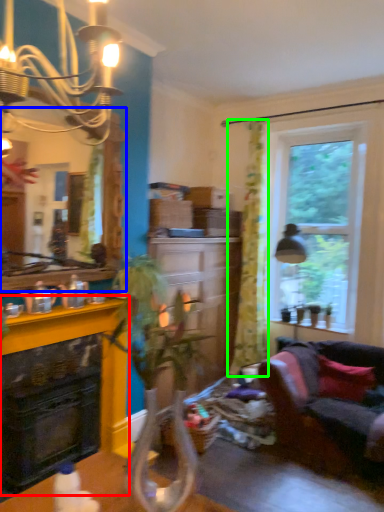
Question: Considering the real-world distances, which object is farthest from fireplace (highlighted by a red box)? mirror (highlighted by a blue box) or curtain (highlighted by a green box)?

Choices:
 (A) mirror
 (B) curtain

Answer: (B)